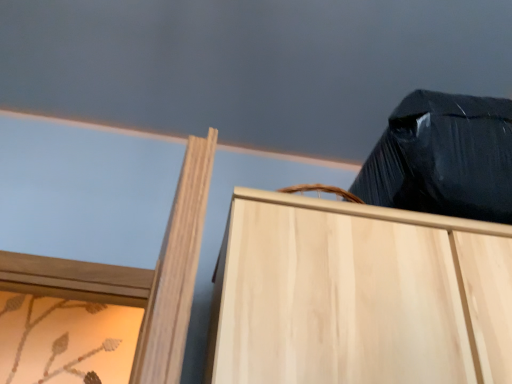
Question: Should I look upward or downward to see black plastic bag at upper right?

Choices:
 (A) up
 (B) down

Answer: (A)